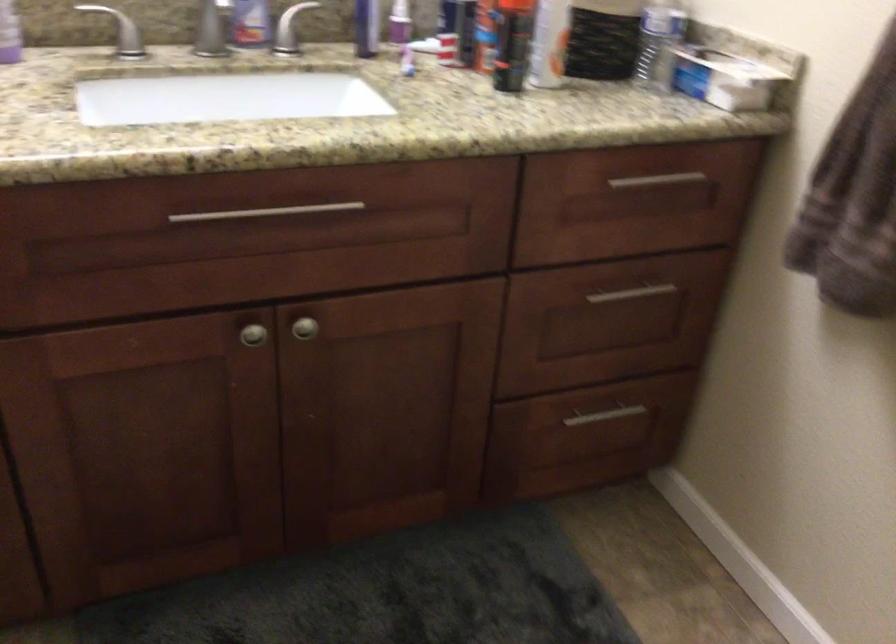
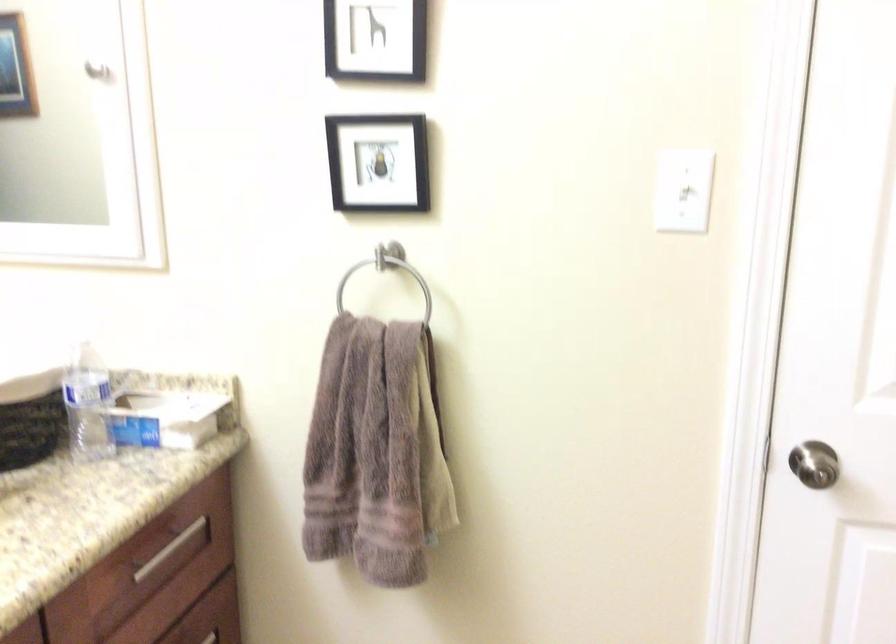
Locate, in the second image, the point that corresponds to (x=707, y=73) in the first image.

(165, 418)